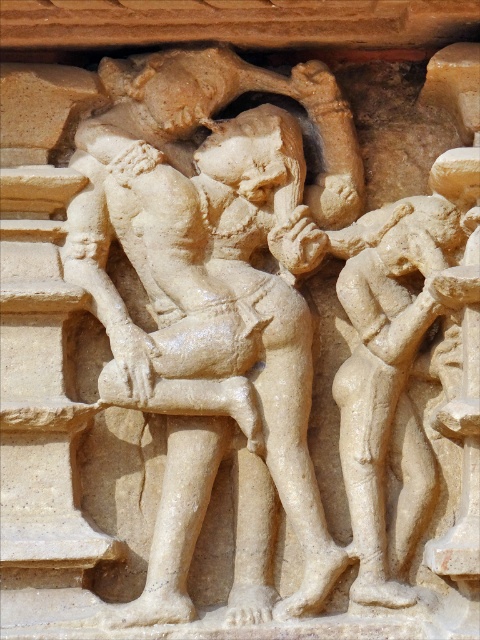
Which is behind, point (261, 509) or point (338, 392)?

The point (261, 509) is more distant.

Is beige stone sculpture at center above beige stone figure at right?

Yes, beige stone sculpture at center is above beige stone figure at right.

This screenshot has height=640, width=480. What do you see at coordinates (215, 300) in the screenshot? I see `beige stone sculpture at center` at bounding box center [215, 300].

Where is `beige stone sculpture at center`? beige stone sculpture at center is located at coordinates (215, 300).